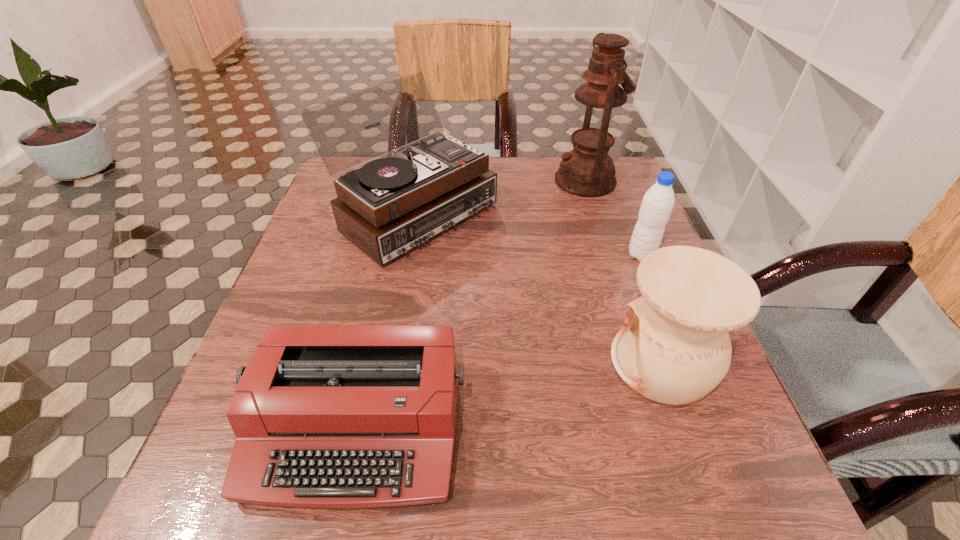
Find the location of `object situated at the near left corner`. object situated at the near left corner is located at coordinates (325, 416).

This screenshot has width=960, height=540. What are the coordinates of `object present at the far right corner` in the screenshot? It's located at (587, 171).

I want to click on free space at the far edge of the desktop, so click(550, 200).

This screenshot has height=540, width=960. I want to click on vacant space at the near edge of the desktop, so click(355, 522).

The height and width of the screenshot is (540, 960). I want to click on vacant space at the left edge of the desktop, so click(x=346, y=313).

Where is `blank area at the right edge`? The width and height of the screenshot is (960, 540). blank area at the right edge is located at coordinates (627, 219).

Identify the location of vacant space at the near right corner of the desktop. Image resolution: width=960 pixels, height=540 pixels. (676, 496).

Locate an element on the screen. vacant space that's between the fourth shortest object and the water bottle is located at coordinates (527, 234).

The width and height of the screenshot is (960, 540). Find the location of `vacant region between the oil lamp and the water bottle`. vacant region between the oil lamp and the water bottle is located at coordinates (613, 218).

Locate an element on the screen. free space between the water bottle and the oil lamp is located at coordinates (613, 218).